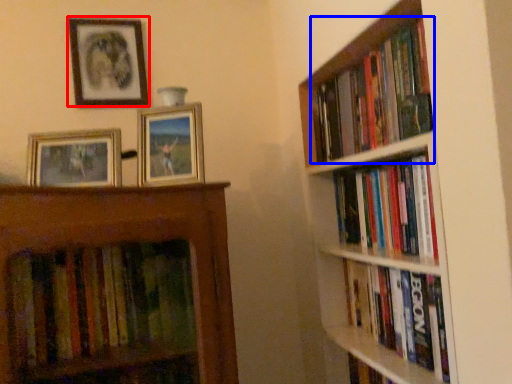
Question: Which point is closer to the camera, picture frame (highlighted by a red box) or book (highlighted by a blue box)?

Choices:
 (A) picture frame
 (B) book

Answer: (B)